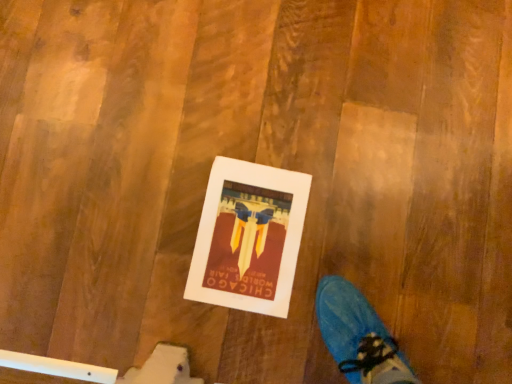
Where is `vacant space to the right of matte paper postcard at center`? vacant space to the right of matte paper postcard at center is located at coordinates (351, 263).